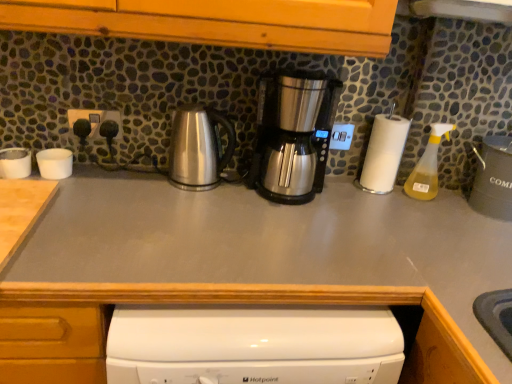
Question: Considering the relative sizes of gray matte countertop at center and white plastic cups at left, placed as the 3th appliance when sorted from right to left, in the image provided, is gray matte countertop at center shorter than white plastic cups at left, placed as the 3th appliance when sorted from right to left,?

Choices:
 (A) yes
 (B) no

Answer: (B)

Question: Would you say white plastic cups at left, placed as the 3th appliance when sorted from right to left, is part of gray matte countertop at center's contents?

Choices:
 (A) no
 (B) yes

Answer: (A)

Question: Considering the relative sizes of gray matte countertop at center and white plastic cups at left, arranged as the first appliance when viewed from the left, in the image provided, is gray matte countertop at center smaller than white plastic cups at left, arranged as the first appliance when viewed from the left,?

Choices:
 (A) no
 (B) yes

Answer: (A)

Question: Considering the relative positions of gray matte countertop at center and white plastic cups at left, placed as the 3th appliance when sorted from right to left, in the image provided, is gray matte countertop at center to the right of white plastic cups at left, placed as the 3th appliance when sorted from right to left, from the viewer's perspective?

Choices:
 (A) yes
 (B) no

Answer: (A)

Question: Is gray matte countertop at center thinner than white plastic cups at left, placed as the 3th appliance when sorted from right to left?

Choices:
 (A) yes
 (B) no

Answer: (B)

Question: From a real-world perspective, does gray matte countertop at center stand above white plastic cups at left, placed as the 3th appliance when sorted from right to left?

Choices:
 (A) yes
 (B) no

Answer: (B)

Question: Is stainless steel coffee maker at center, marked as the 2th kitchen appliance in a left-to-right arrangement, positioned before yellow translucent spray bottle at right?

Choices:
 (A) yes
 (B) no

Answer: (A)

Question: Is stainless steel coffee maker at center, acting as the first kitchen appliance starting from the right, far from yellow translucent spray bottle at right?

Choices:
 (A) yes
 (B) no

Answer: (B)

Question: Is stainless steel coffee maker at center, marked as the 2th kitchen appliance in a left-to-right arrangement, facing away from yellow translucent spray bottle at right?

Choices:
 (A) yes
 (B) no

Answer: (B)

Question: Can you confirm if stainless steel coffee maker at center, marked as the 2th kitchen appliance in a left-to-right arrangement, is thinner than yellow translucent spray bottle at right?

Choices:
 (A) no
 (B) yes

Answer: (A)

Question: Does stainless steel coffee maker at center, marked as the 2th kitchen appliance in a left-to-right arrangement, appear on the right side of yellow translucent spray bottle at right?

Choices:
 (A) yes
 (B) no

Answer: (B)

Question: Can you confirm if stainless steel coffee maker at center, marked as the 2th kitchen appliance in a left-to-right arrangement, is bigger than yellow translucent spray bottle at right?

Choices:
 (A) no
 (B) yes

Answer: (B)

Question: Could white matte cups at left, arranged as the 2th appliance when viewed from the right, be considered to be inside stainless steel coffee maker at center, marked as the 2th kitchen appliance in a left-to-right arrangement?

Choices:
 (A) no
 (B) yes

Answer: (A)